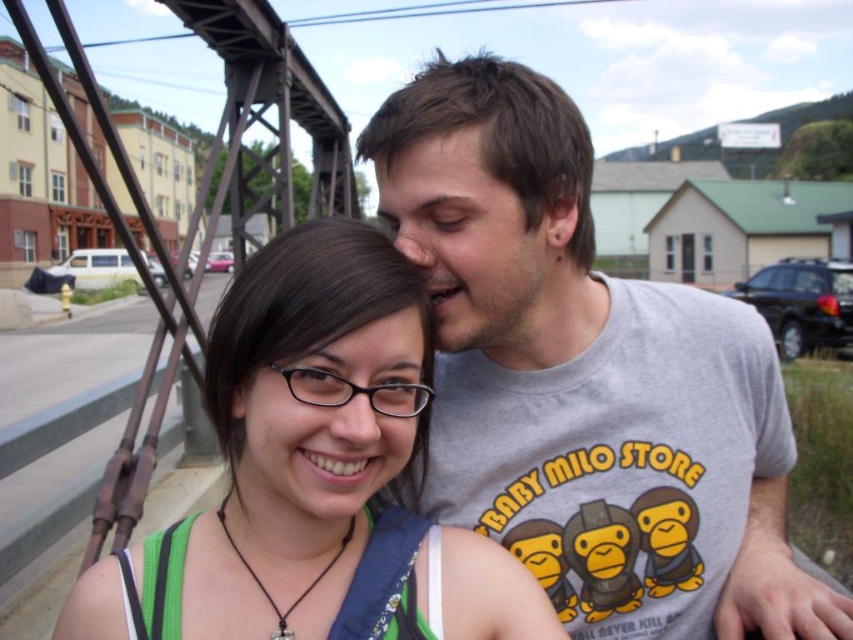
Question: Which object is closer to the camera taking this photo?

Choices:
 (A) gray cotton t-shirt at upper right
 (B) green fabric at center

Answer: (B)

Question: Is gray cotton t-shirt at upper right wider than green fabric at center?

Choices:
 (A) no
 (B) yes

Answer: (B)

Question: Does gray cotton t-shirt at upper right appear on the left side of green fabric at center?

Choices:
 (A) yes
 (B) no

Answer: (B)

Question: Which of the following is the closest to the observer?

Choices:
 (A) (490, 547)
 (B) (770, 358)

Answer: (A)

Question: From the image, what is the correct spatial relationship of gray cotton t-shirt at upper right in relation to green fabric at center?

Choices:
 (A) below
 (B) above

Answer: (B)